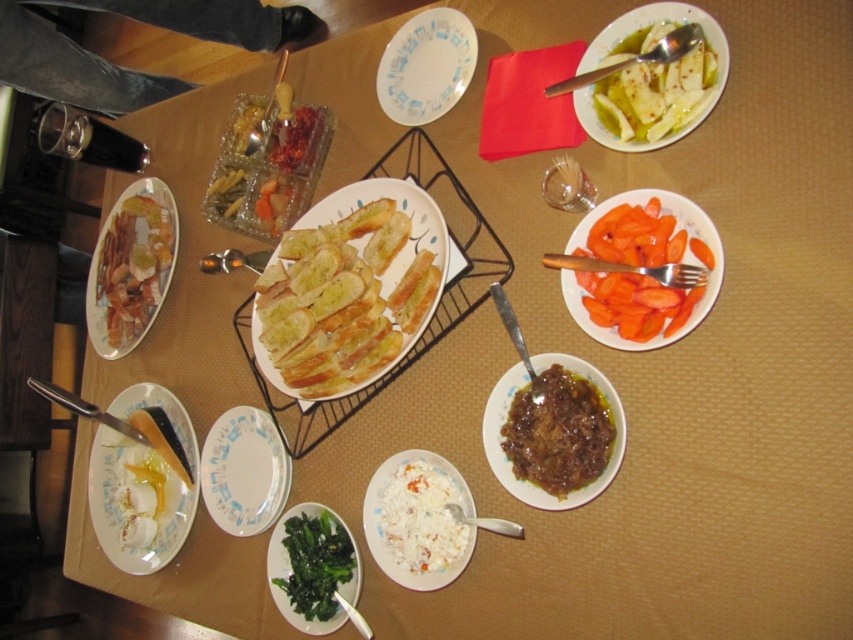
You are a guest at the table and want to reach for the sliced orange carrots at center right. However, there is a white paper plate at lower left in the way. Can you tell me which item is closer to you so you know which to move first?

The sliced orange carrots at center right is closer to you than the white paper plate at lower left, so you should move the sliced orange carrots at center right first.

You are looking down at the table and want to place a napkin exactly at the same position as the sliced orange carrots at center right. What coordinates should you aim for?

The sliced orange carrots at center right are located at coordinates (641, 264), so you should aim for those coordinates to place the napkin.

You are a guest at the table and want to reach for the brown glossy sauce at center. However, there is a matte white plate at lower left in the way. Can you move the plate to access the sauce?

The matte white plate at lower left is positioned over the brown glossy sauce at center, so you would need to move the plate to access the sauce.